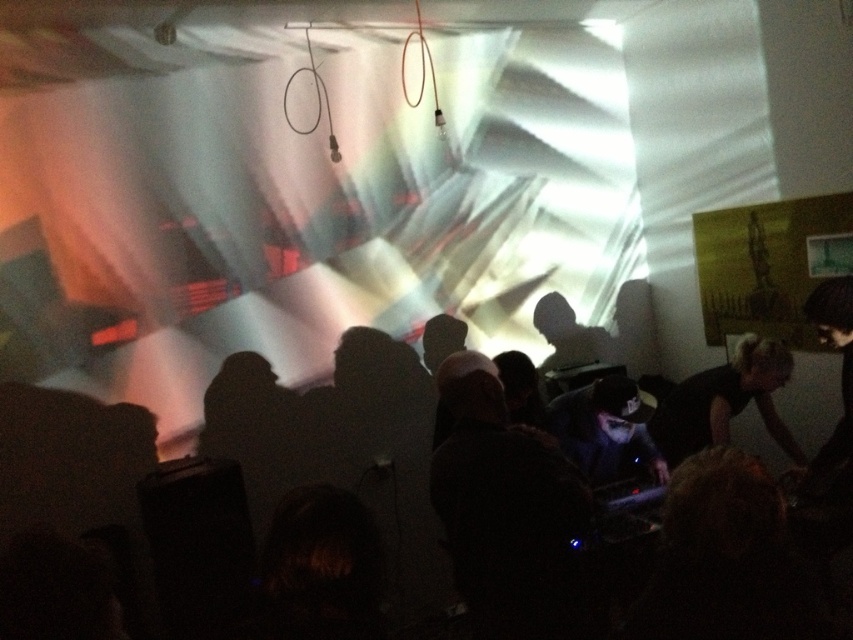
You are a photographer trying to capture a clear shot of the dark hair at center and the black matte shirt at right. Since the lighting is poor, you decide to adjust your camera focus. Which object should you focus on first to ensure it appears sharp in the photo?

The dark hair at center should be focused on first because it is closer to the viewer than the black matte shirt at right, so focusing on it will ensure it appears sharp while the background objects may blur slightly.

In the dimly lit club scene, there is a DJ booth with equipment and a large screen showing geometric patterns. You notice a point marked at coordinates (347, 442). What object or feature does this point correspond to?

The point at coordinates (347, 442) corresponds to dark hair at center.

In the dimly lit club scene, you notice two elements in the foreground near the DJ booth. One is the dark hair at center and the other is the black matte shirt at right. Which of these two elements appears bigger in size?

The dark hair at center appears bigger in size compared to the black matte shirt at right.